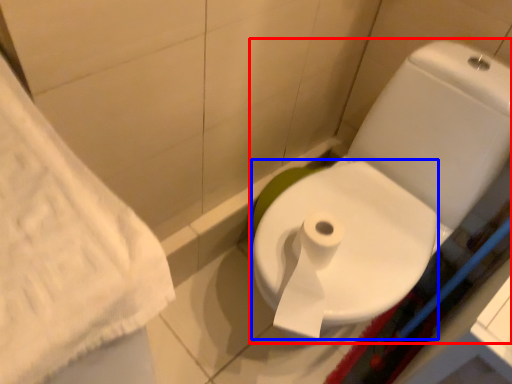
Question: Which object is further to the camera taking this photo, toilet (highlighted by a red box) or bidet (highlighted by a blue box)?

Choices:
 (A) toilet
 (B) bidet

Answer: (B)